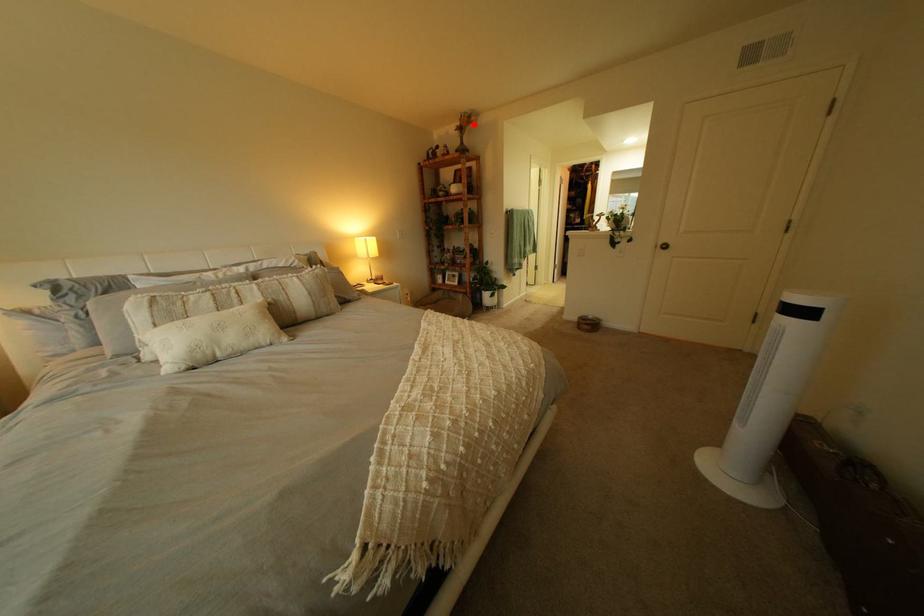
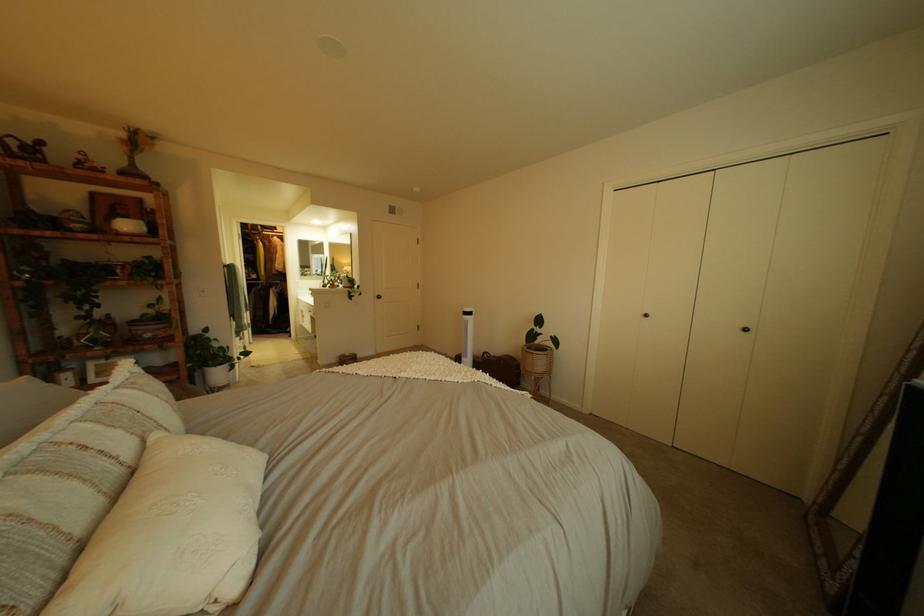
Question: A red point is marked in image1. In image2, is the corresponding 3D point closer to the camera or farther? Reply with the corresponding letter.

Choices:
 (A) The corresponding 3D point is closer.
 (B) The corresponding 3D point is farther.

Answer: (B)